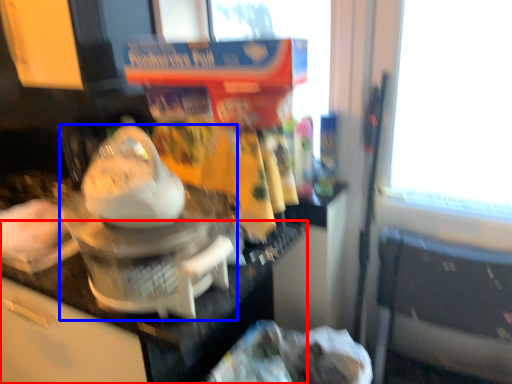
Question: Which point is closer to the camera, counter top (highlighted by a red box) or kitchen appliance (highlighted by a blue box)?

Choices:
 (A) counter top
 (B) kitchen appliance

Answer: (B)